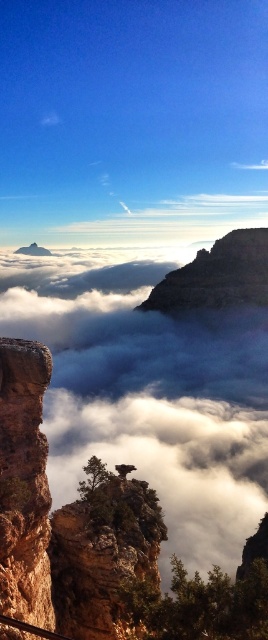
Question: Which object appears closest to the camera in this image?

Choices:
 (A) brown rough rock at center
 (B) rustic sandstone rock formation at left

Answer: (B)

Question: Does brown rough rock at center have a greater width compared to rustic sandstone rock formation at left?

Choices:
 (A) yes
 (B) no

Answer: (A)

Question: Does brown rough rock at center have a larger size compared to rustic sandstone rock formation at left?

Choices:
 (A) yes
 (B) no

Answer: (A)

Question: Does brown rough rock at center have a greater width compared to rustic sandstone rock formation at left?

Choices:
 (A) no
 (B) yes

Answer: (B)

Question: Which of the following is the closest to the observer?

Choices:
 (A) (108, 547)
 (B) (36, 564)

Answer: (B)

Question: Which object appears closest to the camera in this image?

Choices:
 (A) brown rough rock at center
 (B) rustic sandstone rock formation at left

Answer: (B)